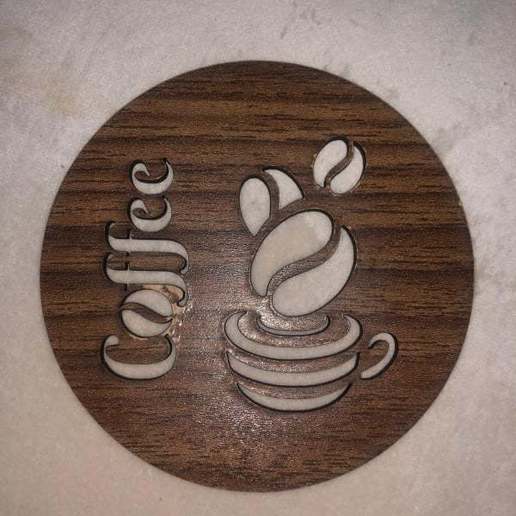
Find the location of a particular element. cofee mug middle is located at coordinates coord(298,377).